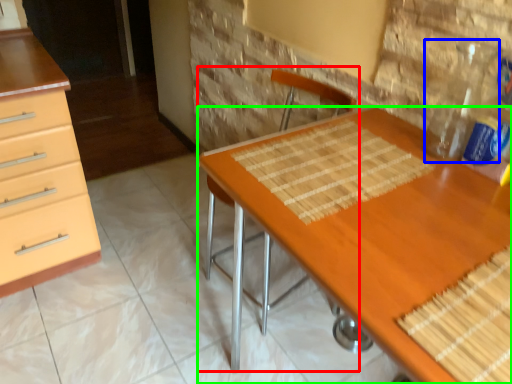
Question: Which object is the farthest from armchair (highlighted by a red box)? Choose among these: bottle (highlighted by a blue box) or desk (highlighted by a green box).

Choices:
 (A) bottle
 (B) desk

Answer: (A)